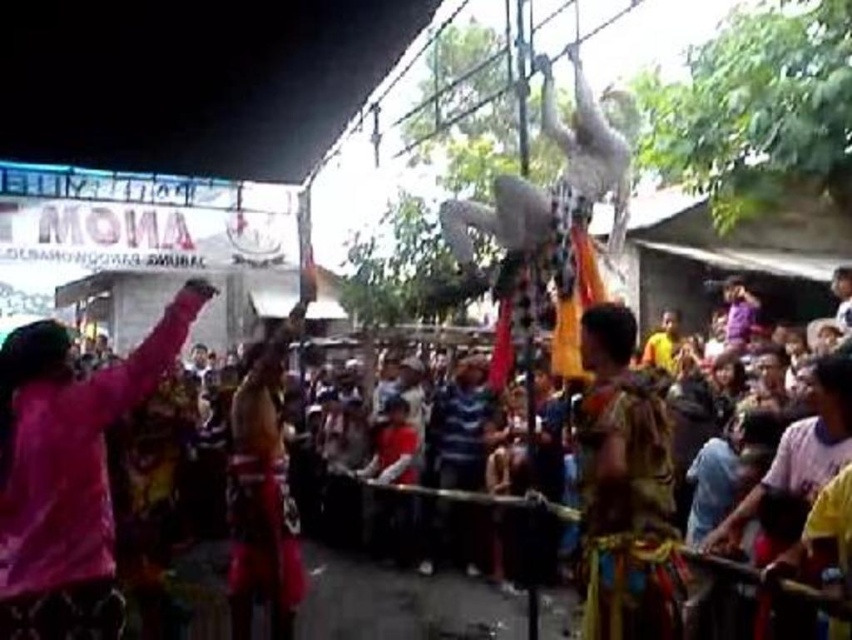
Between multicolored fabric crowd at center and reddish-brown fabric costume at center, which one is positioned higher?

multicolored fabric crowd at center is higher up.

Does multicolored fabric crowd at center have a lesser height compared to reddish-brown fabric costume at center?

Indeed, multicolored fabric crowd at center has a lesser height compared to reddish-brown fabric costume at center.

Does point (73, 486) come in front of point (296, 556)?

Yes, point (73, 486) is closer to viewer.

Locate an element on the screen. multicolored fabric crowd at center is located at coordinates (82, 445).

Is purple fabric at left shorter than multicolored fabric at center?

Yes.

Where is `purple fabric at left`? This screenshot has width=852, height=640. purple fabric at left is located at coordinates (68, 472).

Where is `purple fabric at left`? purple fabric at left is located at coordinates (68, 472).

Between point (55, 387) and point (33, 529), which one is positioned behind?

The point (55, 387) is behind.

Can you confirm if purple fabric at left is thinner than multicolored fabric crowd at center?

Incorrect, purple fabric at left's width is not less than multicolored fabric crowd at center's.

This screenshot has height=640, width=852. I want to click on purple fabric at left, so click(x=68, y=472).